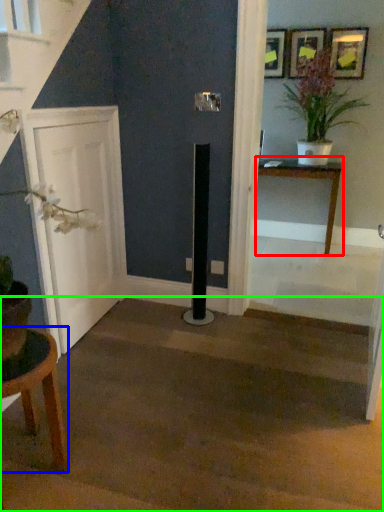
Question: Based on their relative distances, which object is nearer to table (highlighted by a red box)? Choose from table (highlighted by a blue box) and stairwell (highlighted by a green box).

Choices:
 (A) table
 (B) stairwell

Answer: (B)